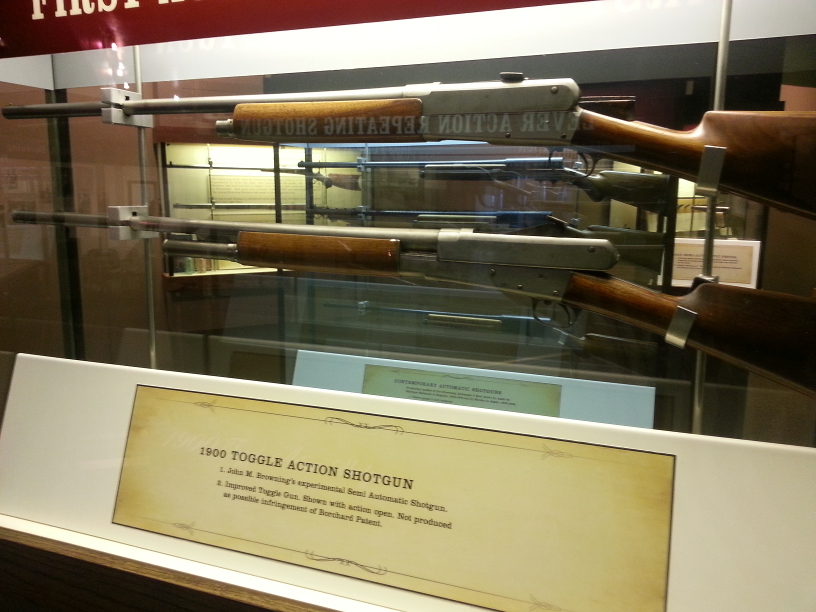
The height and width of the screenshot is (612, 816). Find the location of `clamp`. clamp is located at coordinates (143, 225).